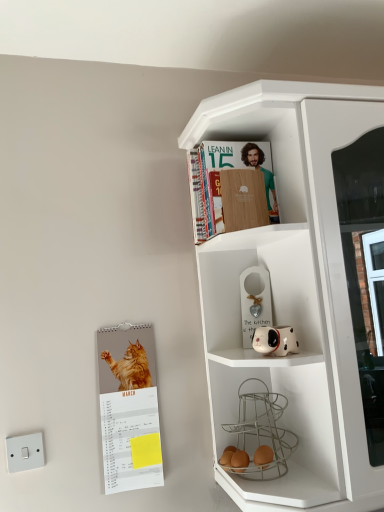
Locate an element on the screen. The height and width of the screenshot is (512, 384). white matte cupboard at upper right is located at coordinates (291, 292).

This screenshot has height=512, width=384. What do you see at coordinates (219, 181) in the screenshot? I see `wooden cover book at upper center` at bounding box center [219, 181].

Locate an element on the screen. white glossy dog-shaped planter at middle right is located at coordinates (275, 340).

At what (x,y) coordinates should I click in order to perform the action: click on white matte cupboard at upper right. Please return your answer as a coordinate pair (x, y). The width and height of the screenshot is (384, 512). Looking at the image, I should click on (291, 292).

Can you confirm if white glossy dog-shaped planter at middle right is taller than orange fur cat calendar at left?

No, white glossy dog-shaped planter at middle right is not taller than orange fur cat calendar at left.

Which point is more forward, (x=281, y=341) or (x=155, y=466)?

Point (x=281, y=341)

From a real-world perspective, is white glossy dog-shaped planter at middle right over orange fur cat calendar at left?

Indeed, from a real-world perspective, white glossy dog-shaped planter at middle right stands above orange fur cat calendar at left.

Looking at the image, does white glossy dog-shaped planter at middle right seem bigger or smaller compared to orange fur cat calendar at left?

white glossy dog-shaped planter at middle right is smaller than orange fur cat calendar at left.

Can we say orange fur cat calendar at left lies outside white matte cupboard at upper right?

That's correct, orange fur cat calendar at left is outside of white matte cupboard at upper right.

You are a GUI agent. You are given a task and a screenshot of the screen. Output one action in this format:
    pyautogui.click(x=<x>, y=<y>)
    Task: Click on the cupboard in front of the orange fur cat calendar at left
    The width and height of the screenshot is (384, 512).
    Given the screenshot: What is the action you would take?
    pyautogui.click(x=291, y=292)

Between point (124, 364) and point (346, 105), which one is positioned behind?

Point (124, 364)

How different are the orientations of orange fur cat calendar at left and white matte cupboard at upper right in degrees?

orange fur cat calendar at left and white matte cupboard at upper right are facing 0.103 degrees away from each other.

Which of these two, white matte cupboard at upper right or wooden cover book at upper center, stands taller?

white matte cupboard at upper right is taller.

From a real-world perspective, is white matte cupboard at upper right located beneath wooden cover book at upper center?

Yes.

Is white matte cupboard at upper right aimed at wooden cover book at upper center?

Yes, white matte cupboard at upper right is aimed at wooden cover book at upper center.

Which object is closer to the camera, white matte cupboard at upper right or wooden cover book at upper center?

white matte cupboard at upper right.

Is white matte cupboard at upper right positioned beyond the bounds of orange fur cat calendar at left?

Absolutely, white matte cupboard at upper right is external to orange fur cat calendar at left.

Which of these two, white matte cupboard at upper right or orange fur cat calendar at left, is bigger?

With larger size is white matte cupboard at upper right.

Between point (329, 440) and point (115, 347), which one is positioned in front?

The point (329, 440) is in front.

In the scene shown: From a real-world perspective, which is physically below, white matte cupboard at upper right or orange fur cat calendar at left?

In real-world perspective, orange fur cat calendar at left is lower.

Considering the relative sizes of white glossy dog-shaped planter at middle right and white plastic switch at lower left in the image provided, is white glossy dog-shaped planter at middle right thinner than white plastic switch at lower left?

Incorrect, the width of white glossy dog-shaped planter at middle right is not less than that of white plastic switch at lower left.

Which of these two, white glossy dog-shaped planter at middle right or white plastic switch at lower left, stands taller?

white plastic switch at lower left is taller.

Is the position of white glossy dog-shaped planter at middle right less distant than that of white plastic switch at lower left?

Yes, white glossy dog-shaped planter at middle right is closer to the viewer.

Consider the image. What's the angular difference between white glossy dog-shaped planter at middle right and white plastic switch at lower left's facing directions?

There is a 90.4-degree angle between the facing directions of white glossy dog-shaped planter at middle right and white plastic switch at lower left.

From a real-world perspective, is white matte cupboard at upper right on top of white plastic switch at lower left?

Yes, from a real-world perspective, white matte cupboard at upper right is above white plastic switch at lower left.

This screenshot has height=512, width=384. What are the coordinates of `cupboard above the white plastic switch at lower left (from the image's perspective)` in the screenshot? It's located at (291, 292).

Is white matte cupboard at upper right oriented towards white plastic switch at lower left?

No.

Is white matte cupboard at upper right smaller than white plastic switch at lower left?

No.

Is orange fur cat calendar at left oriented towards white plastic switch at lower left?

No, orange fur cat calendar at left does not turn towards white plastic switch at lower left.

Choose the correct answer: Is orange fur cat calendar at left inside white plastic switch at lower left or outside it?

orange fur cat calendar at left is located beyond the bounds of white plastic switch at lower left.

Is there a large distance between orange fur cat calendar at left and white plastic switch at lower left?

No, orange fur cat calendar at left is in close proximity to white plastic switch at lower left.

Considering the sizes of objects orange fur cat calendar at left and white plastic switch at lower left in the image provided, who is taller, orange fur cat calendar at left or white plastic switch at lower left?

orange fur cat calendar at left.

You are a GUI agent. You are given a task and a screenshot of the screen. Output one action in this format:
    pyautogui.click(x=<x>, y=<y>)
    Task: Click on the paperback book below the white glossy dog-shaped planter at middle right (from the image's perspective)
    The width and height of the screenshot is (384, 512).
    Given the screenshot: What is the action you would take?
    pyautogui.click(x=129, y=408)

The width and height of the screenshot is (384, 512). What are the coordinates of `paperback book on the left side of white matte cupboard at upper right` in the screenshot? It's located at (129, 408).

Based on their spatial positions, is white plastic switch at lower left or white glossy dog-shaped planter at middle right closer to white matte cupboard at upper right?

The object closer to white matte cupboard at upper right is white glossy dog-shaped planter at middle right.

Based on their spatial positions, is white matte cupboard at upper right or white plastic switch at lower left closer to white glossy dog-shaped planter at middle right?

Among the two, white matte cupboard at upper right is located nearer to white glossy dog-shaped planter at middle right.

When comparing their distances from wooden cover book at upper center, does white plastic switch at lower left or white matte cupboard at upper right seem closer?

The object closer to wooden cover book at upper center is white matte cupboard at upper right.

Looking at the image, which one is located closer to white plastic switch at lower left, white matte cupboard at upper right or wooden cover book at upper center?

white matte cupboard at upper right is positioned closer to the anchor white plastic switch at lower left.

From the picture: Based on their spatial positions, is white plastic switch at lower left or white matte cupboard at upper right closer to white glossy dog-shaped planter at middle right?

white matte cupboard at upper right is positioned closer to the anchor white glossy dog-shaped planter at middle right.

Based on their spatial positions, is white glossy dog-shaped planter at middle right or white plastic switch at lower left closer to wooden cover book at upper center?

white glossy dog-shaped planter at middle right is positioned closer to the anchor wooden cover book at upper center.

Which object lies nearer to the anchor point white glossy dog-shaped planter at middle right, wooden cover book at upper center or white plastic switch at lower left?

Among the two, wooden cover book at upper center is located nearer to white glossy dog-shaped planter at middle right.

When comparing their distances from white matte cupboard at upper right, does white glossy dog-shaped planter at middle right or white plastic switch at lower left seem closer?

The object closer to white matte cupboard at upper right is white glossy dog-shaped planter at middle right.

Where is `paperback book between white plastic switch at lower left and white matte cupboard at upper right from left to right`? This screenshot has width=384, height=512. paperback book between white plastic switch at lower left and white matte cupboard at upper right from left to right is located at coordinates (129, 408).

Where is `toy between wooden cover book at upper center and white plastic switch at lower left in the up-down direction`? Image resolution: width=384 pixels, height=512 pixels. toy between wooden cover book at upper center and white plastic switch at lower left in the up-down direction is located at coordinates (275, 340).

Where is `paperback book between white plastic switch at lower left and white glossy dog-shaped planter at middle right from left to right`? Image resolution: width=384 pixels, height=512 pixels. paperback book between white plastic switch at lower left and white glossy dog-shaped planter at middle right from left to right is located at coordinates (129, 408).

You are a GUI agent. You are given a task and a screenshot of the screen. Output one action in this format:
    pyautogui.click(x=<x>, y=<y>)
    Task: Click on the cupboard that lies between wooden cover book at upper center and white plastic switch at lower left from top to bottom
    The image size is (384, 512).
    Given the screenshot: What is the action you would take?
    pyautogui.click(x=291, y=292)